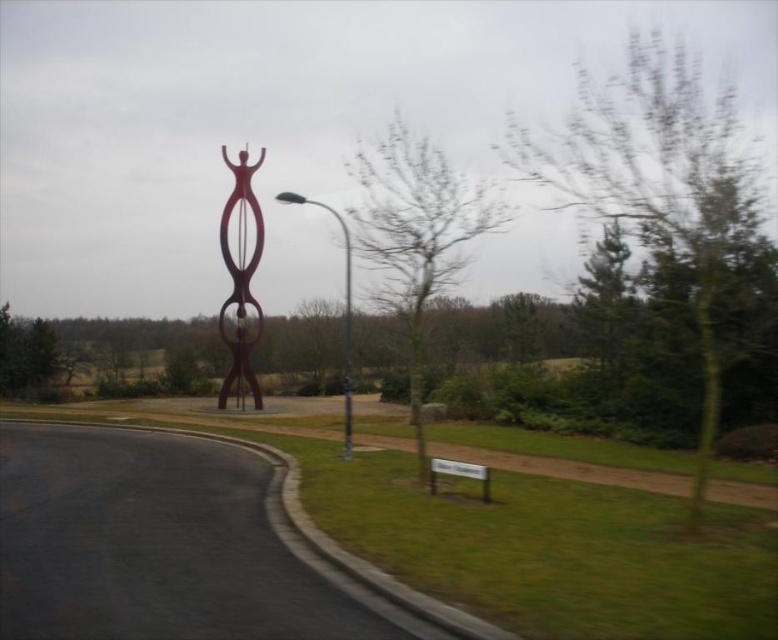
Question: Considering the real-world distances, which object is farthest from the green leafy tree at center?

Choices:
 (A) metallic pole at center
 (B) glossy metal sculpture at center

Answer: (B)

Question: Which object is closer to the camera taking this photo?

Choices:
 (A) metallic gray pole at center
 (B) metallic pole at center

Answer: (B)

Question: Estimate the real-world distances between objects in this image. Which object is closer to the glossy metal sculpture at center?

Choices:
 (A) metallic gray pole at center
 (B) metallic pole at center
 (C) green leafy tree at center

Answer: (A)

Question: Does glossy metal sculpture at center appear on the right side of metallic pole at center?

Choices:
 (A) yes
 (B) no

Answer: (B)

Question: Is green leafy tree at upper right positioned at the back of green leafy tree at center?

Choices:
 (A) no
 (B) yes

Answer: (A)

Question: Does glossy metal sculpture at center have a smaller size compared to metallic gray pole at center?

Choices:
 (A) yes
 (B) no

Answer: (A)